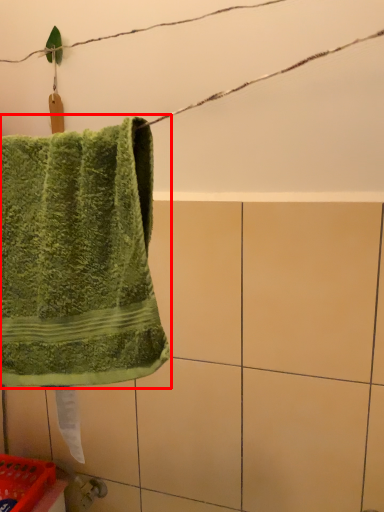
Question: From the image, what is the correct spatial relationship of towel (annotated by the red box) in relation to basket?

Choices:
 (A) left
 (B) right

Answer: (B)